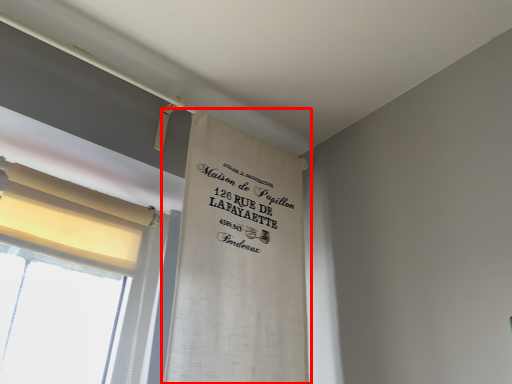
Question: From the image, what is the correct spatial relationship of curtain (annotated by the red box) in relation to curtain?

Choices:
 (A) right
 (B) left

Answer: (A)